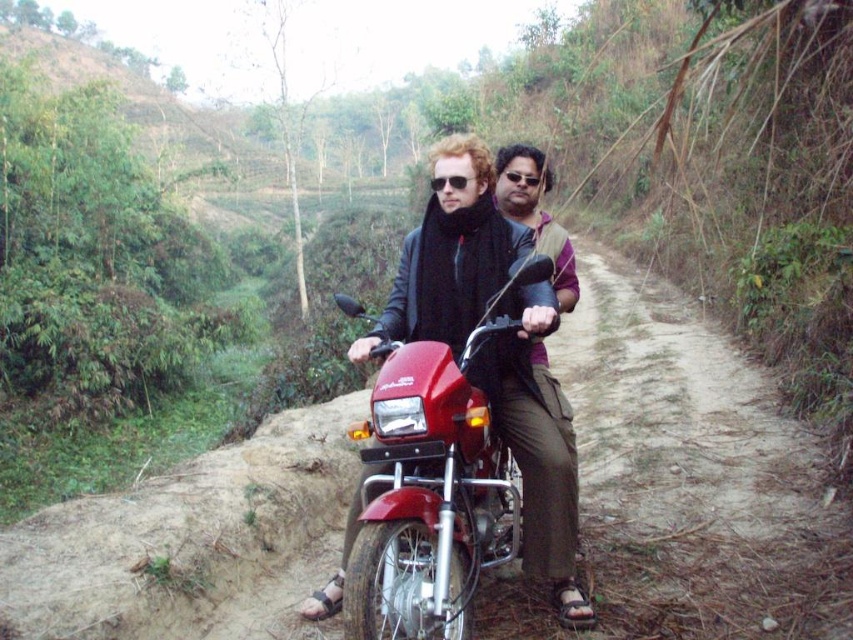
Question: Does dirt track at center have a lesser width compared to matte black vest at center?

Choices:
 (A) no
 (B) yes

Answer: (B)

Question: Which object is closer to the camera taking this photo?

Choices:
 (A) matte black motorcycle at center
 (B) matte black vest at center

Answer: (A)

Question: Does dirt track at center appear on the left side of matte black motorcycle at center?

Choices:
 (A) yes
 (B) no

Answer: (B)

Question: Which object is the closest to the matte black vest at center?

Choices:
 (A) dirt track at center
 (B) matte black motorcycle at center

Answer: (A)

Question: Is dirt track at center closer to camera compared to matte black vest at center?

Choices:
 (A) no
 (B) yes

Answer: (A)

Question: Which object is positioned farthest from the matte black vest at center?

Choices:
 (A) matte black motorcycle at center
 (B) dirt track at center

Answer: (A)